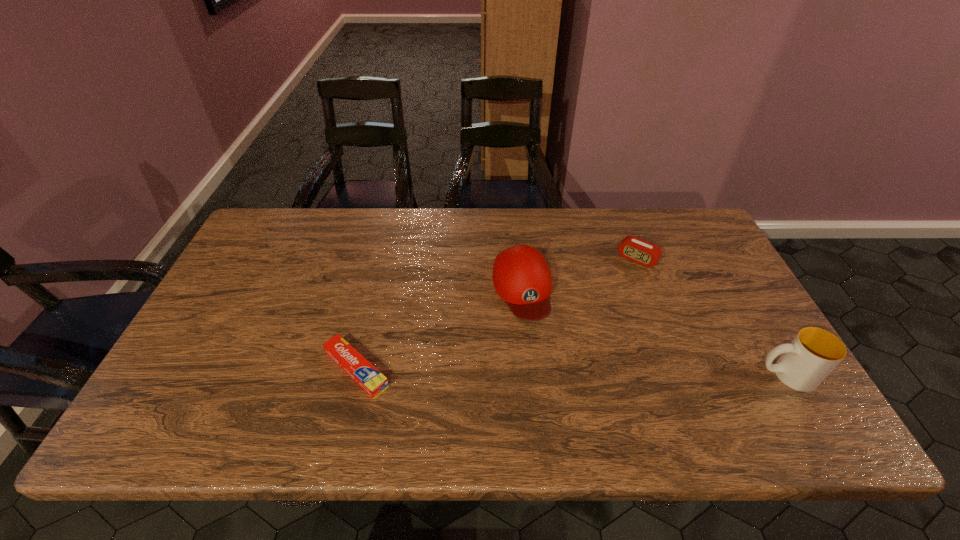
Where is `vacant space that is in between the baseball cap and the leftmost object`? Image resolution: width=960 pixels, height=540 pixels. vacant space that is in between the baseball cap and the leftmost object is located at coordinates (440, 329).

The width and height of the screenshot is (960, 540). I want to click on free point between the alarm clock and the baseball cap, so click(x=580, y=273).

Find the location of a particular element. free space between the shortest object and the third object from left to right is located at coordinates (497, 314).

Locate an element on the screen. This screenshot has width=960, height=540. empty space between the rightmost object and the toothpaste is located at coordinates (571, 372).

Where is `vacant area between the second shortest object and the rightmost object`? The width and height of the screenshot is (960, 540). vacant area between the second shortest object and the rightmost object is located at coordinates (711, 316).

Locate an element on the screen. This screenshot has width=960, height=540. free space between the third tallest object and the rightmost object is located at coordinates (711, 316).

Where is `free spot between the alarm clock and the leftmost object`? free spot between the alarm clock and the leftmost object is located at coordinates (497, 314).

Locate which object ranks second in proximity to the baseball cap. Please provide its 2D coordinates. Your answer should be formatted as a tuple, i.e. [(x, y)], where the tuple contains the x and y coordinates of a point satisfying the conditions above.

[(351, 361)]

In order to click on the closest object relative to the baseball cap in this screenshot , I will do `click(635, 249)`.

At what (x,y) coordinates should I click in order to perform the action: click on free space that satisfies the following two spatial constraints: 1. on the front side of the rightmost object; 2. with the handle on the side of the shortest object. Please return your answer as a coordinate pair (x, y). Image resolution: width=960 pixels, height=540 pixels. Looking at the image, I should click on (355, 375).